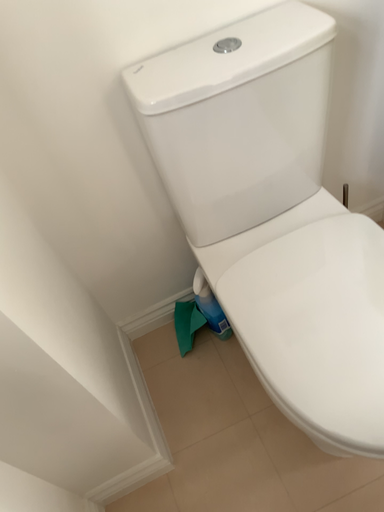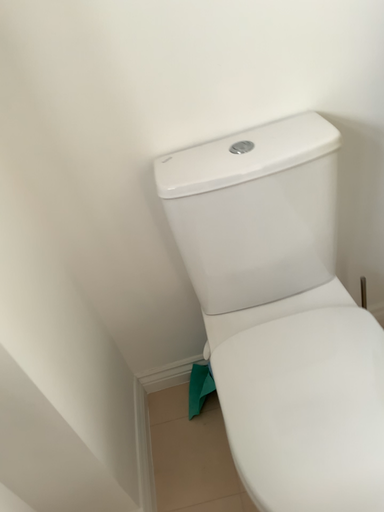
Question: How did the camera likely rotate when shooting the video?

Choices:
 (A) rotated downward
 (B) rotated upward

Answer: (B)